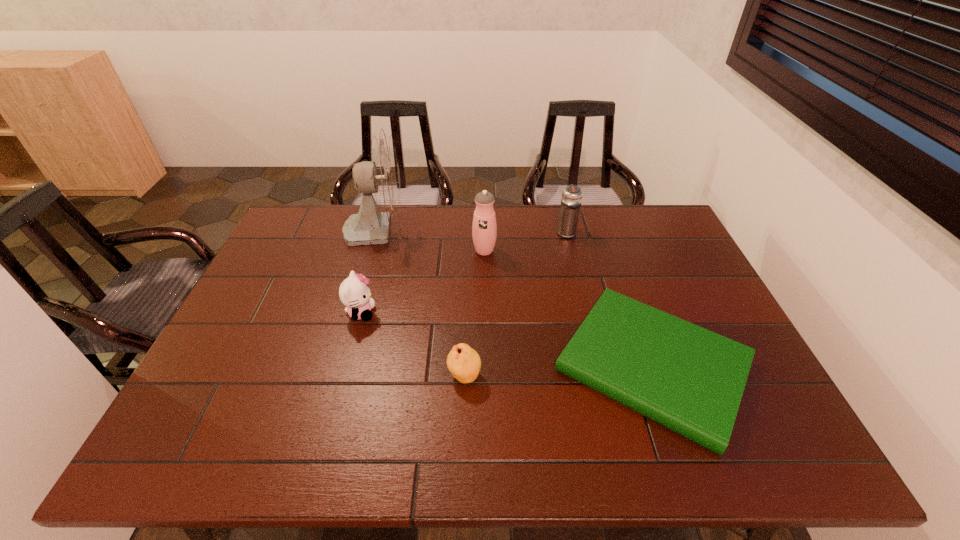
This screenshot has height=540, width=960. What are the coordinates of `the tallest object` in the screenshot? It's located at (381, 176).

At what (x,y) coordinates should I click in order to perform the action: click on the taller thermos bottle. Please return your answer as a coordinate pair (x, y). The width and height of the screenshot is (960, 540). Looking at the image, I should click on (484, 228).

The width and height of the screenshot is (960, 540). Find the location of `the nearer thermos bottle`. the nearer thermos bottle is located at coordinates (484, 228).

Find the location of a particular element. Image resolution: width=960 pixels, height=540 pixels. the right thermos bottle is located at coordinates (571, 200).

The height and width of the screenshot is (540, 960). I want to click on the shorter thermos bottle, so click(x=571, y=200).

Locate an element on the screen. The image size is (960, 540). the fourth tallest object is located at coordinates coord(354,292).

Identify the location of pear. Image resolution: width=960 pixels, height=540 pixels. (464, 363).

You are a GUI agent. You are given a task and a screenshot of the screen. Output one action in this format:
    pyautogui.click(x=<x>, y=<y>)
    Task: Click on the paperback book
    This screenshot has height=540, width=960.
    Given the screenshot: What is the action you would take?
    click(x=690, y=380)

This screenshot has width=960, height=540. What are the coordinates of `vacant space situated 0.050m in front of the fan to blow air` in the screenshot? It's located at coord(421,229).

You are a GUI agent. You are given a task and a screenshot of the screen. Output one action in this format:
    pyautogui.click(x=<x>, y=<y>)
    Task: Click on the free space located on the front of the left thermos bottle
    
    Given the screenshot: What is the action you would take?
    pyautogui.click(x=485, y=311)